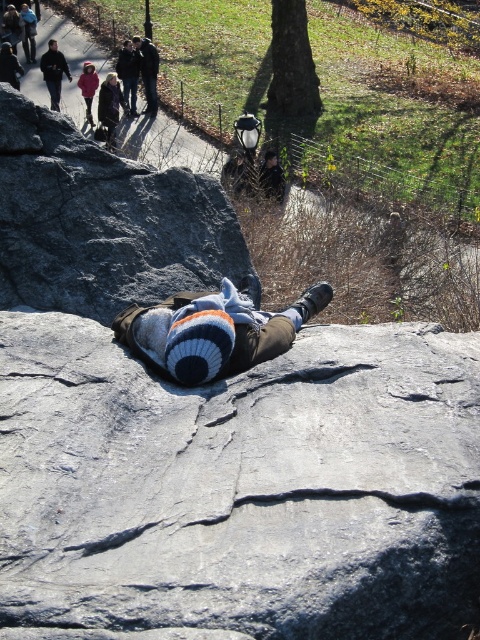
Question: Which object is positioned closest to the dark blue knit sweater at upper center?

Choices:
 (A) gray rough rock at center
 (B) matte black jacket at upper left
 (C) matte pink jacket at upper left
 (D) knit wool hat at center

Answer: (C)

Question: Among these objects, which one is farthest from the camera?

Choices:
 (A) dark blue knit sweater at upper center
 (B) matte black jacket at upper left

Answer: (A)

Question: Which point is farther to the camera?

Choices:
 (A) matte black jacket at upper left
 (B) dark blue knit sweater at upper center
 (C) knit wool hat at center

Answer: (B)

Question: Is knit wool hat at center bigger than matte pink jacket at upper left?

Choices:
 (A) no
 (B) yes

Answer: (B)

Question: Is matte black jacket at upper left thinner than matte pink jacket at upper left?

Choices:
 (A) yes
 (B) no

Answer: (B)

Question: Is dark blue knit sweater at upper center positioned at the back of matte black jacket at upper left?

Choices:
 (A) yes
 (B) no

Answer: (A)